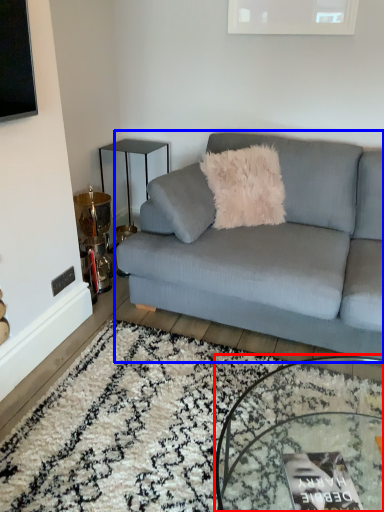
Question: Which point is closer to the camera, coffee table (highlighted by a red box) or studio couch (highlighted by a blue box)?

Choices:
 (A) coffee table
 (B) studio couch

Answer: (A)